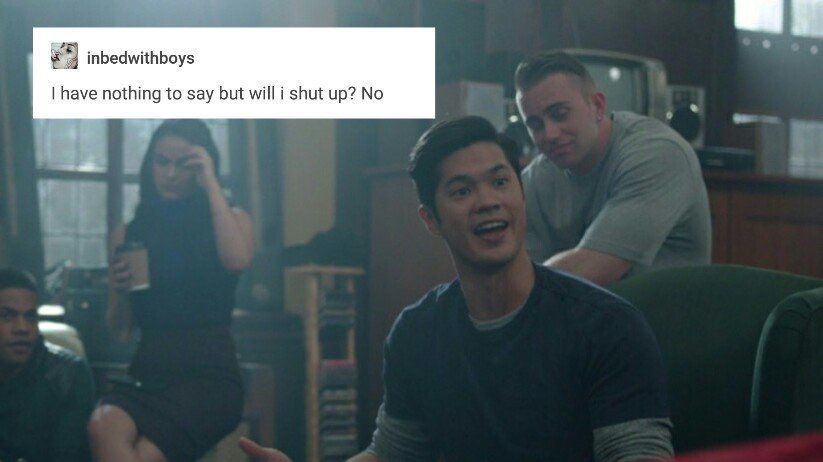
Where is `windows`? windows is located at coordinates (774, 16), (798, 130), (119, 157).